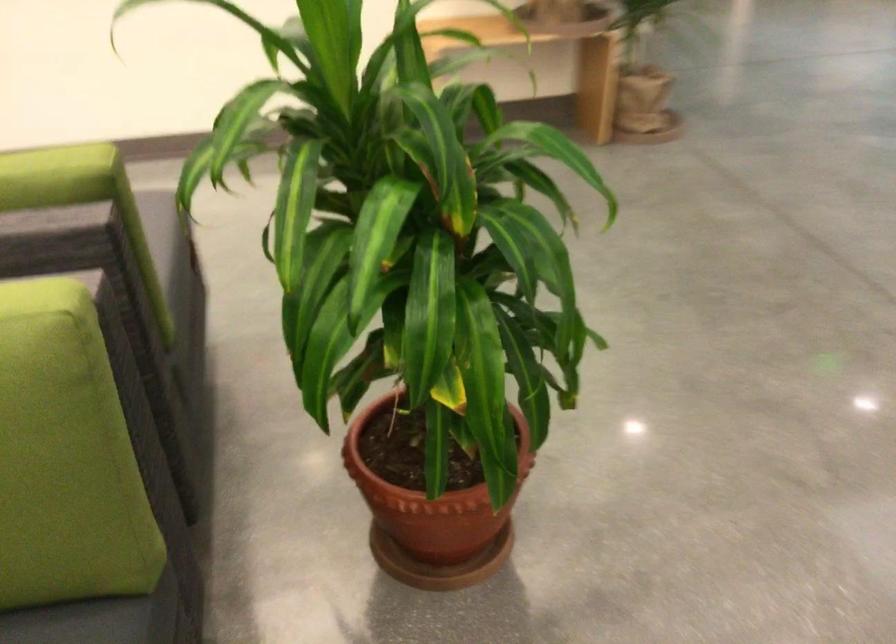
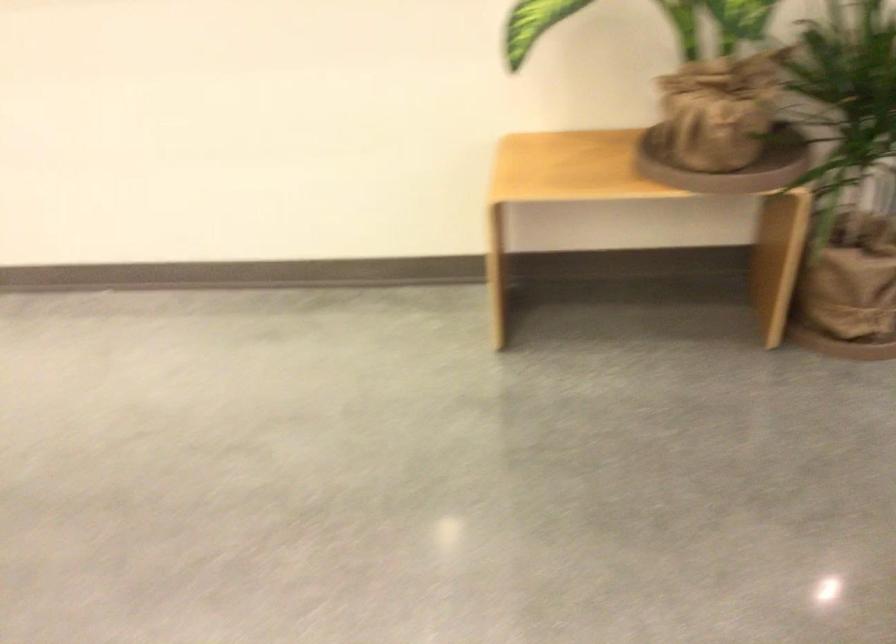
The images are taken continuously from a first-person perspective. In which direction are you moving?

The cameraman walked toward right, forward.